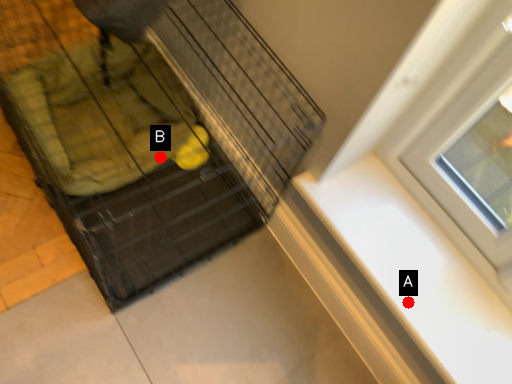
Question: Two points are circled on the image, labeled by A and B beside each circle. Which point is closer to the camera?

Choices:
 (A) A is closer
 (B) B is closer

Answer: (A)